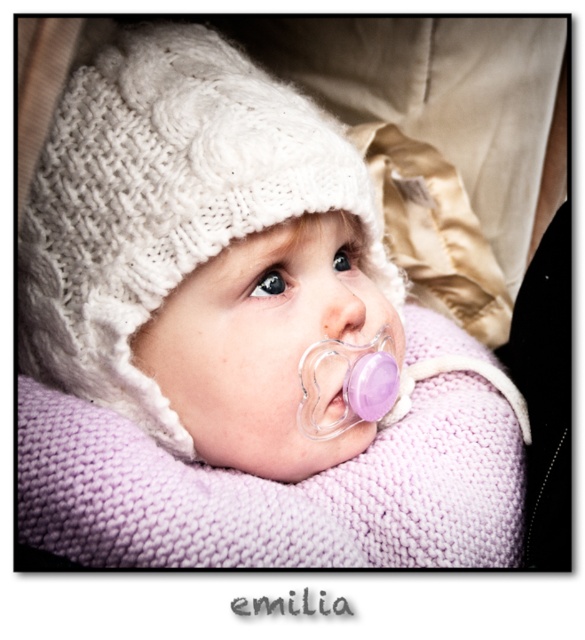
Which is more to the left, purple matte pacifier at center or purple rubber pacifier at center?

From the viewer's perspective, purple rubber pacifier at center appears more on the left side.

Is point (347, 317) positioned in front of point (325, 406)?

That is True.

Where is `purple matte pacifier at center`? purple matte pacifier at center is located at coordinates (342, 304).